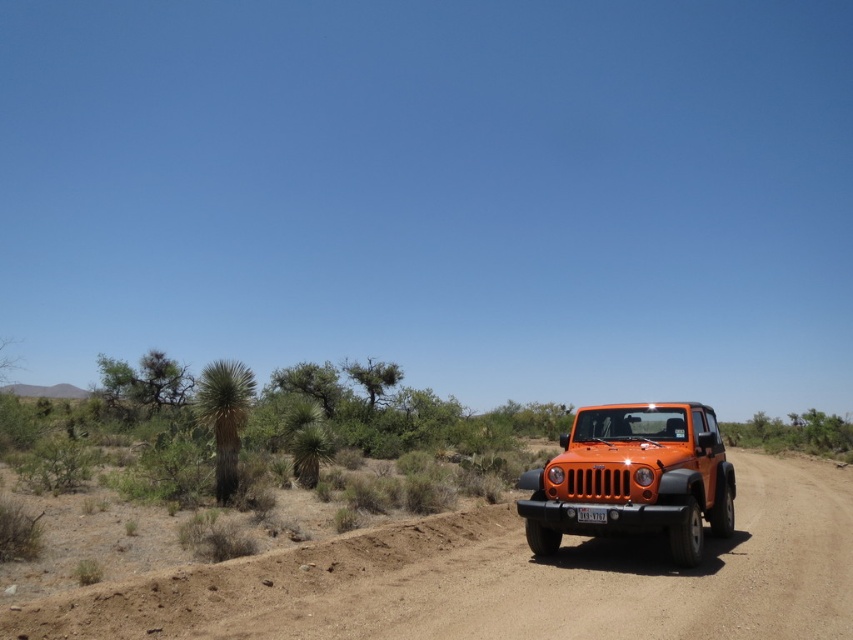
Question: Which point appears closest to the camera in this image?

Choices:
 (A) (637, 410)
 (B) (447, 637)

Answer: (B)

Question: Which object appears farthest from the camera in this image?

Choices:
 (A) orange matte jeep at center
 (B) dirt track at center

Answer: (A)

Question: Which object is farther from the camera taking this photo?

Choices:
 (A) dirt track at center
 (B) orange matte jeep at center

Answer: (B)

Question: Is dirt track at center wider than orange matte jeep at center?

Choices:
 (A) yes
 (B) no

Answer: (A)

Question: Does dirt track at center have a greater width compared to orange matte jeep at center?

Choices:
 (A) no
 (B) yes

Answer: (B)

Question: Is dirt track at center to the left of orange matte jeep at center from the viewer's perspective?

Choices:
 (A) yes
 (B) no

Answer: (B)